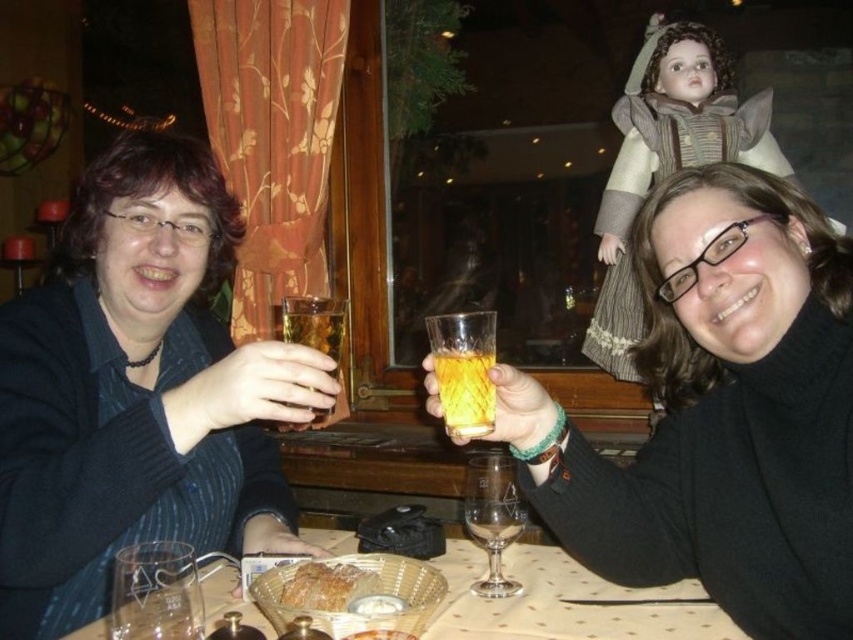
Can you confirm if translucent glass at center is positioned below translucent amber liquid at center?

No, translucent glass at center is not below translucent amber liquid at center.

Is point (706, 355) farther from camera compared to point (450, 413)?

Yes, it is.

Between point (709, 186) and point (473, 385), which one is positioned behind?

The point (709, 186) is more distant.

Where is `translucent glass at center`? This screenshot has height=640, width=853. translucent glass at center is located at coordinates point(718,412).

Does matte black sweater at upper left appear over clear glass wine glass at center?

Indeed, matte black sweater at upper left is positioned over clear glass wine glass at center.

Who is more distant from viewer, [122,166] or [471,484]?

The point [122,166] is more distant.

The width and height of the screenshot is (853, 640). I want to click on matte black sweater at upper left, so click(137, 392).

Who is positioned more to the left, translucent glass at center or clear glass wine glass at center?

From the viewer's perspective, clear glass wine glass at center appears more on the left side.

Image resolution: width=853 pixels, height=640 pixels. I want to click on translucent glass at center, so click(718, 412).

Is point (766, 298) more distant than point (496, 528)?

No, (766, 298) is in front of (496, 528).

Where is `translucent glass at center`? translucent glass at center is located at coordinates (718, 412).